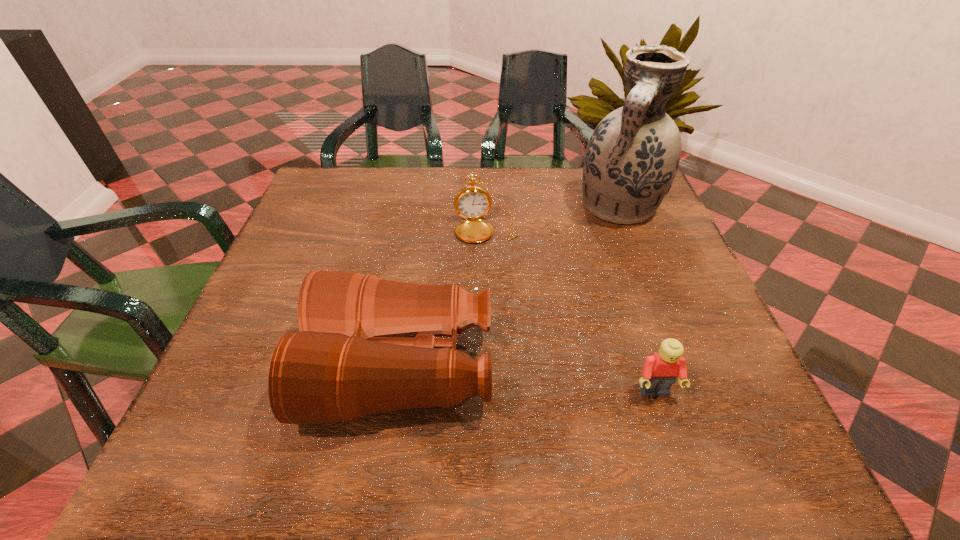
You are a GUI agent. You are given a task and a screenshot of the screen. Output one action in this format:
    pyautogui.click(x=<x>, y=<y>)
    Task: Click on the free space located 0.160m with the handle on the side of the tallest object
    This screenshot has height=540, width=960.
    Given the screenshot: What is the action you would take?
    (x=592, y=273)

What are the coordinates of `free space located 0.100m with the handle on the side of the tallest object` in the screenshot? It's located at (599, 256).

Locate an element on the screen. vacant point located with the handle on the side of the tallest object is located at coordinates (574, 313).

The image size is (960, 540). What are the coordinates of `pocket watch at the far edge` in the screenshot? It's located at (472, 202).

At what (x,y) coordinates should I click in order to perform the action: click on vase that is at the far edge. Please return your answer as a coordinate pair (x, y). This screenshot has height=540, width=960. Looking at the image, I should click on (632, 157).

I want to click on binoculars situated at the near edge, so click(366, 345).

Where is `Lego that is at the near edge`? The image size is (960, 540). Lego that is at the near edge is located at coordinates (660, 371).

Where is `Lego that is positioned at the right edge`? Lego that is positioned at the right edge is located at coordinates (660, 371).

This screenshot has height=540, width=960. Identify the location of vase that is at the right edge. (632, 157).

Where is `object that is at the far right corner`? object that is at the far right corner is located at coordinates (632, 157).